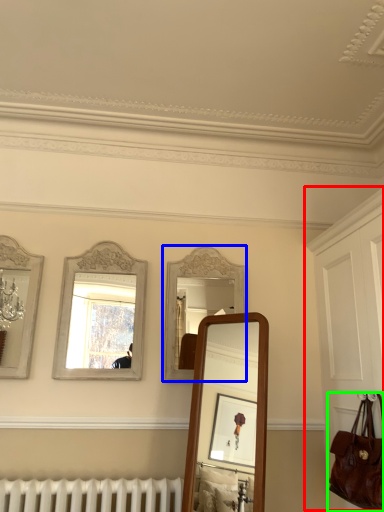
Question: Estimate the real-world distances between objects in this image. Which object is closer to dresser (highlighted by a red box), mirror (highlighted by a blue box) or handbag (highlighted by a green box)?

Choices:
 (A) mirror
 (B) handbag

Answer: (B)